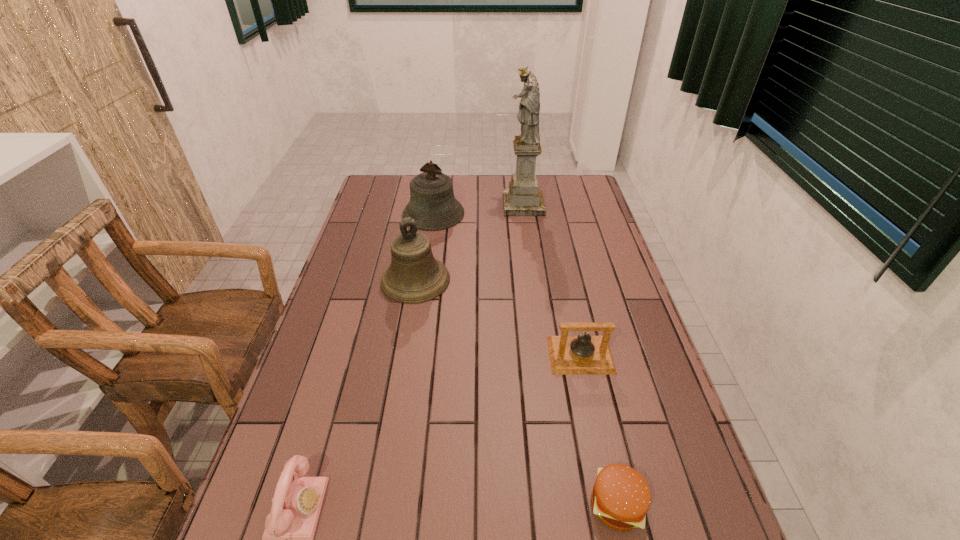
At what (x,y) coordinates should I click in order to perform the action: click on the tallest object. Please return your answer as a coordinate pair (x, y). Looking at the image, I should click on (523, 198).

At what (x,y) coordinates should I click in order to perform the action: click on the third farthest object. Please return your answer as a coordinate pair (x, y). The image size is (960, 540). Looking at the image, I should click on point(414,276).

Where is `the farthest bell`? the farthest bell is located at coordinates [433, 206].

Where is `the nearest bell`? the nearest bell is located at coordinates (569, 355).

The image size is (960, 540). In order to click on the rightmost bell in this screenshot , I will do `click(569, 355)`.

Identify the location of the shortest object. (621, 497).

Where is `free spot located 0.090m on the front-facing side of the tallest object`? The image size is (960, 540). free spot located 0.090m on the front-facing side of the tallest object is located at coordinates (480, 205).

Identify the location of free region located on the front-facing side of the tallest object. The image size is (960, 540). (412, 205).

Where is `vacant space located 0.170m on the front-facing side of the tallest object`? vacant space located 0.170m on the front-facing side of the tallest object is located at coordinates (460, 205).

You are a GUI agent. You are given a task and a screenshot of the screen. Output one action in this format:
    pyautogui.click(x=<x>, y=<y>)
    Task: Click on the blank space located 0.120m on the front of the fourth nearest object
    This screenshot has width=960, height=540.
    Given the screenshot: What is the action you would take?
    pyautogui.click(x=407, y=334)